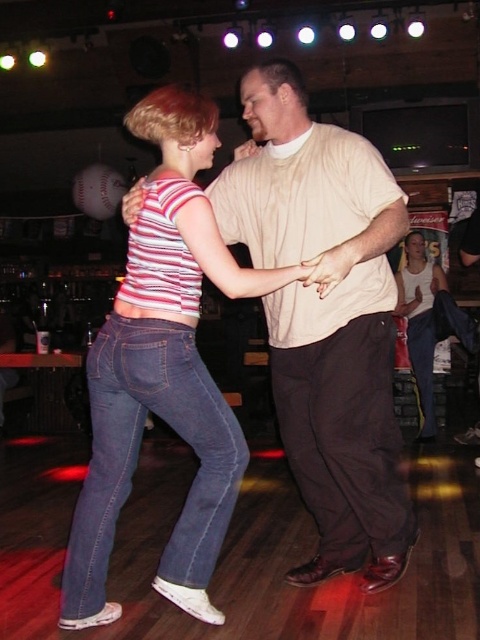
Question: Which object is positioned closest to the matte beige shirt at center?

Choices:
 (A) white matte tank top at center
 (B) striped cotton tank top at center
 (C) denim jeans at lower left

Answer: (A)

Question: Does denim jeans at lower left have a smaller size compared to matte beige shirt at center?

Choices:
 (A) no
 (B) yes

Answer: (A)

Question: From the image, what is the correct spatial relationship of striped cotton tank top at center in relation to denim jeans at lower left?

Choices:
 (A) below
 (B) above

Answer: (B)

Question: Which of these objects is positioned closest to the matte beige shirt at center?

Choices:
 (A) striped cotton tank top at center
 (B) white matte tank top at center
 (C) denim jeans at lower left

Answer: (B)

Question: In this image, where is striped cotton tank top at center located relative to denim jeans at lower left?

Choices:
 (A) right
 (B) left

Answer: (A)

Question: Which point is closer to the camera?

Choices:
 (A) white matte tank top at center
 (B) denim jeans at lower left
 (C) striped cotton tank top at center

Answer: (C)